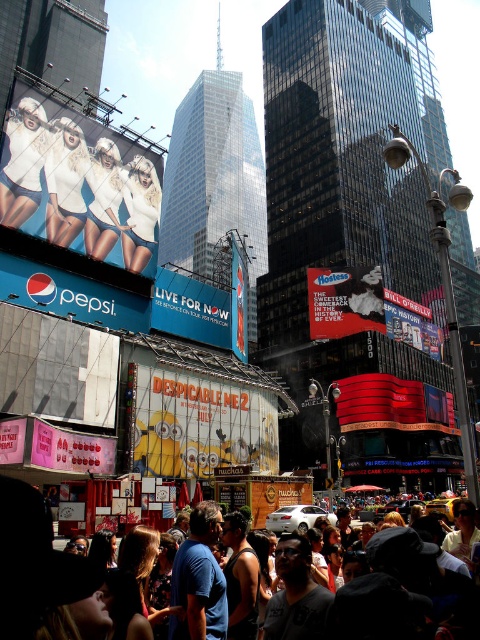
You are a photographer trying to capture both the white matte clothing at center and the yellow cartoon character at center in a single frame. Based on their sizes, which object should you focus on to ensure both fit in the photo?

The white matte clothing at center might be wider than yellow cartoon character at center, so focusing on the white matte clothing at center would ensure both fit in the photo.

You are a photographer trying to capture both the yellow cartoon characters at center and the white matte shorts at upper left in a single shot. Given their size difference, which object should you focus on to ensure both are visible in your photo?

The yellow cartoon characters at center are taller than the white matte shorts at upper left. To capture both in a single shot, focus on the yellow cartoon characters at center as the primary subject while ensuring the white matte shorts at upper left are within the frame.